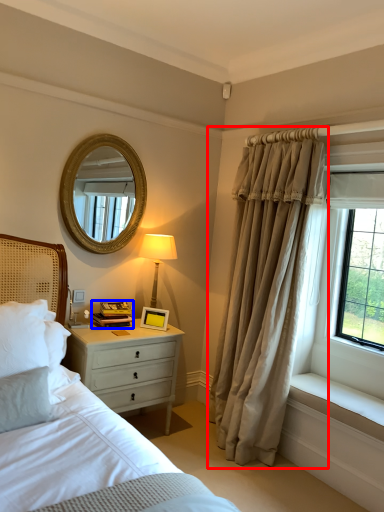
Question: Which object appears farthest to the camera in this image, curtain (highlighted by a red box) or book (highlighted by a blue box)?

Choices:
 (A) curtain
 (B) book

Answer: (B)